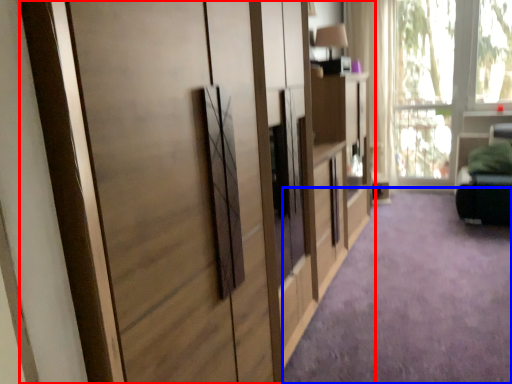
Question: Which of the following is the closest to the observer, cupboard (highlighted by a red box) or plain (highlighted by a blue box)?

Choices:
 (A) cupboard
 (B) plain

Answer: (A)